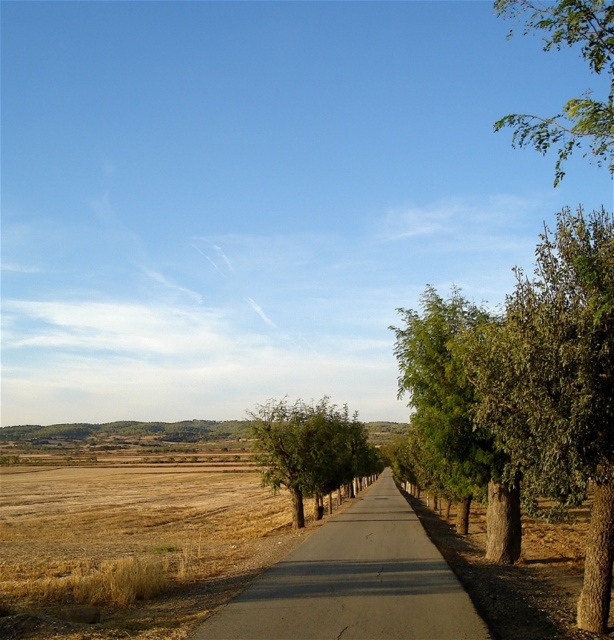
Is asphalt road at center above green leafy tree at center-right?

No.

Which is behind, point (378, 588) or point (453, 378)?

Positioned behind is point (453, 378).

Which is behind, point (241, 634) or point (446, 406)?

The point (446, 406) is behind.

Where is `asphalt road at center`? asphalt road at center is located at coordinates (354, 582).

Measure the distance between point (222,624) and camera.

Point (222,624) is 8.83 meters away from camera.

This screenshot has height=640, width=614. I want to click on asphalt road at center, so click(x=354, y=582).

Locate an element on the screen. The height and width of the screenshot is (640, 614). asphalt road at center is located at coordinates (354, 582).

Can you confirm if asphalt road at center is wider than green leafy tree at center?

No.

Looking at this image, who is shorter, asphalt road at center or green leafy tree at center?

asphalt road at center

Is point (426, 625) farther from viewer compared to point (363, 458)?

No.

Image resolution: width=614 pixels, height=640 pixels. I want to click on asphalt road at center, so click(x=354, y=582).